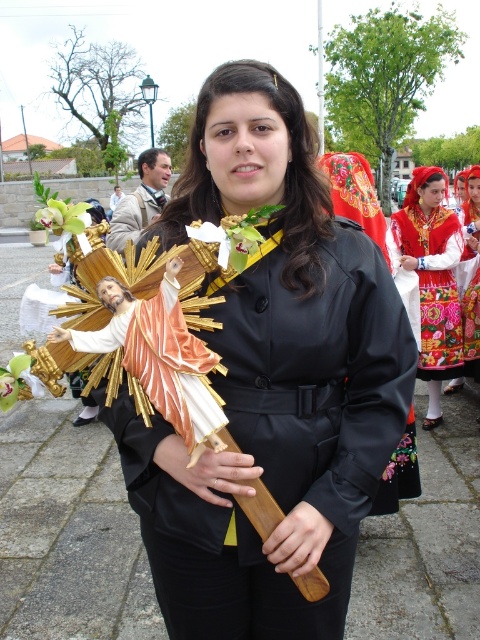
Can you confirm if matte black coat at center is wider than embroidered fabric dress at center?

Indeed, matte black coat at center has a greater width compared to embroidered fabric dress at center.

Based on the photo, is matte black coat at center above embroidered fabric dress at center?

Actually, matte black coat at center is below embroidered fabric dress at center.

Does point (254, 177) come behind point (425, 179)?

No, it is in front of (425, 179).

At what (x,y) coordinates should I click in order to perform the action: click on matte black coat at center. Please return your answer as a coordinate pair (x, y). Image resolution: width=480 pixels, height=640 pixels. Looking at the image, I should click on (272, 381).

Does matte black coat at center have a lesser width compared to green matte flower at upper left?

Correct, matte black coat at center's width is less than green matte flower at upper left's.

Is matte black coat at center to the right of green matte flower at upper left from the viewer's perspective?

Indeed, matte black coat at center is positioned on the right side of green matte flower at upper left.

Is point (166, 531) more distant than point (45, 221)?

Yes.

Where is `matte black coat at center`? matte black coat at center is located at coordinates (272, 381).

Which of these two, green leafy flower at lower left or green matte flower at upper left, stands shorter?

green leafy flower at lower left is shorter.

Can you confirm if green leafy flower at lower left is positioned above green matte flower at upper left?

Actually, green leafy flower at lower left is below green matte flower at upper left.

Find the location of a particular element. green leafy flower at lower left is located at coordinates (17, 380).

What are the coordinates of `green leafy flower at lower left` in the screenshot? It's located at (17, 380).